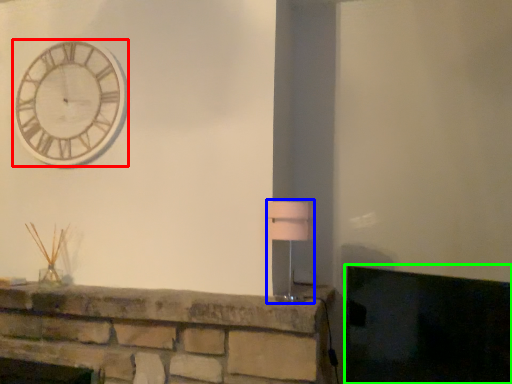
Question: Which object is the farthest from wall clock (highlighted by a red box)? Choose among these: table lamp (highlighted by a blue box) or fireplace (highlighted by a green box).

Choices:
 (A) table lamp
 (B) fireplace

Answer: (B)